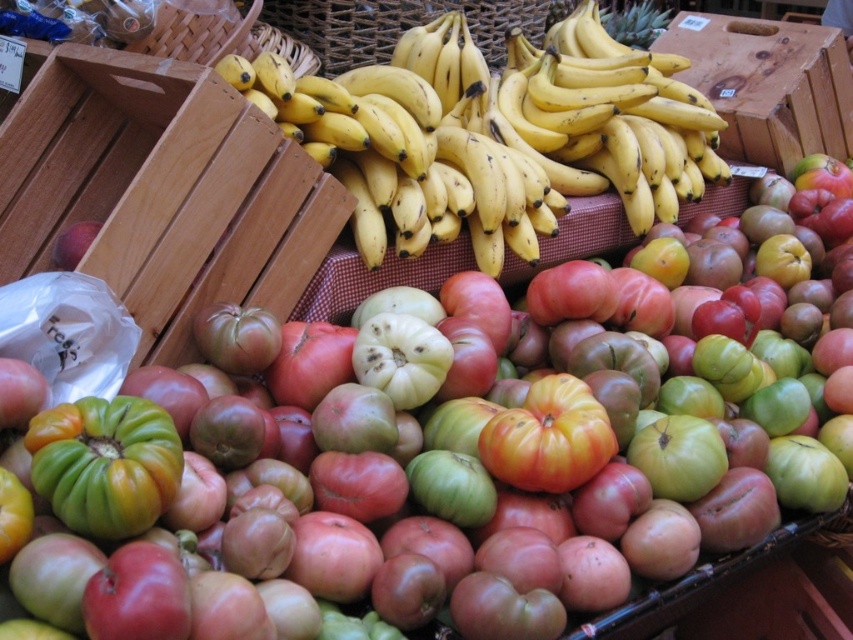
Question: Which object appears closest to the camera in this image?

Choices:
 (A) ripe red tomato at center
 (B) wooden crate at upper right
 (C) yellow matte bananas at center

Answer: (A)

Question: Where is wooden crate at upper right located in relation to ripe red tomato at center in the image?

Choices:
 (A) above
 (B) below

Answer: (A)

Question: Observing the image, what is the correct spatial positioning of wooden crate at upper left in reference to wooden crate at upper right?

Choices:
 (A) below
 (B) above

Answer: (A)

Question: Which of the following is the closest to the observer?

Choices:
 (A) (372, 102)
 (B) (177, 307)
 (C) (537, 448)
 (D) (808, 141)

Answer: (C)

Question: Which object is positioned farthest from the ripe red tomato at center?

Choices:
 (A) yellow matte bananas at center
 (B) wooden crate at upper left
 (C) wooden crate at upper right

Answer: (C)

Question: Can you confirm if yellow matte bananas at center is smaller than ripe red tomato at center?

Choices:
 (A) yes
 (B) no

Answer: (B)